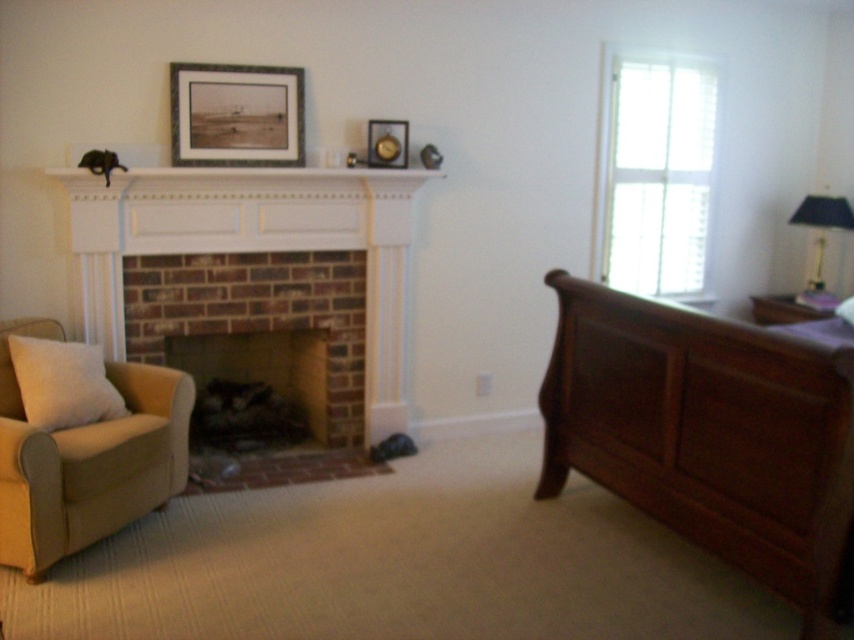
You are arranging a small table between the beige fabric pillow at lower left and the metallic gold lamp at upper right. Which side of the table should you place the pillow on?

The beige fabric pillow at lower left should be placed on the left side of the table since it is positioned on the left side of the metallic gold lamp at upper right.

You are an interior designer planning to place a new piece of furniture in the room. You have a small decorative item that needs to fit next to the white brick fireplace at center and the metallic gold lamp at upper right. Given their sizes, which object should you place the item next to?

The metallic gold lamp at upper right is smaller in size than the white brick fireplace at center, so the decorative item should be placed next to the metallic gold lamp at upper right to ensure proper spacing.